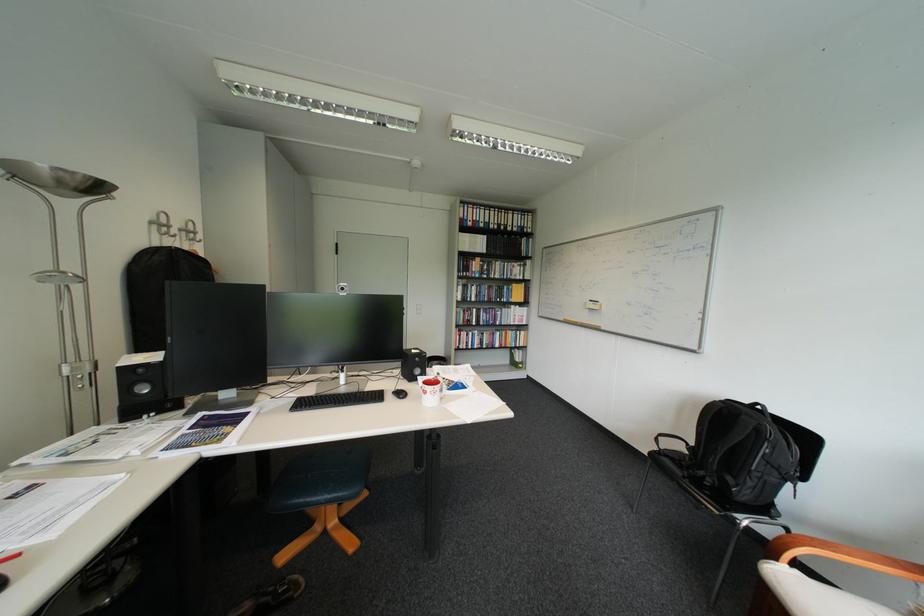
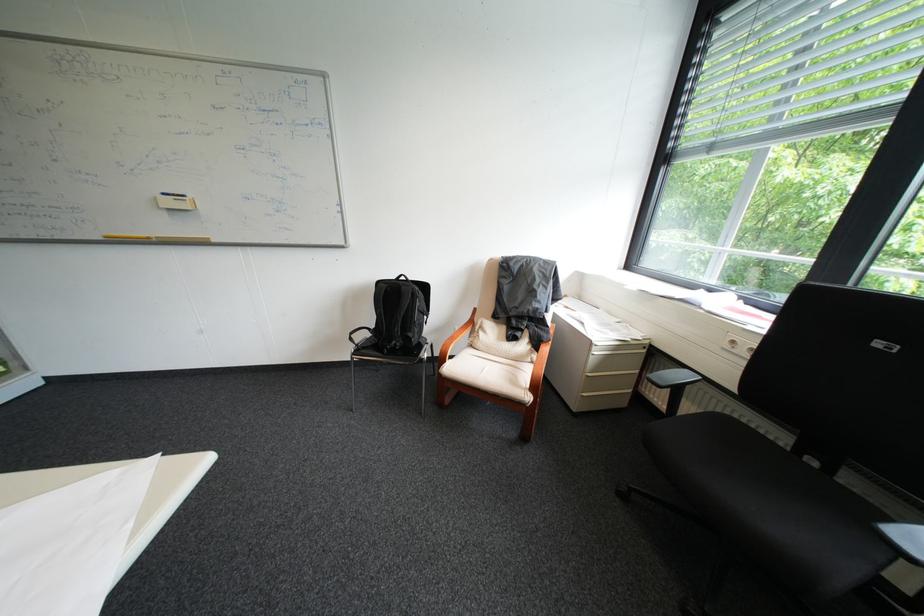
Where in the second image is the point corresponding to (x=756, y=418) from the first image?

(415, 288)